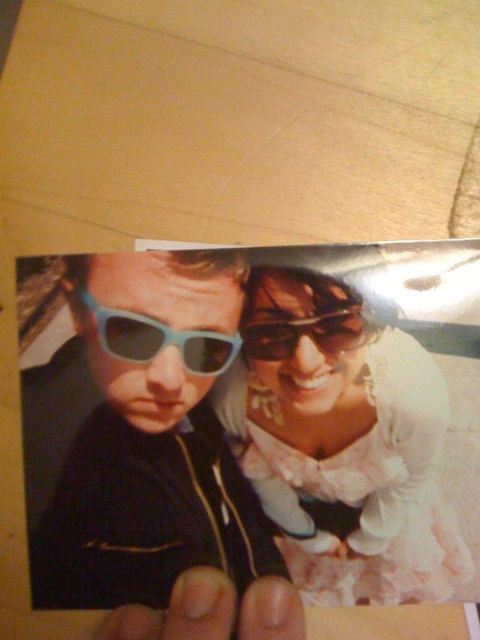
You are a photographer trying to frame a shot. You have the matte plastic sunglasses at left and the matte white dress at center in your viewfinder. Based on their positions and the scene described, which object would you adjust to ensure both fit within the frame?

The matte plastic sunglasses at left might be wider than the matte white dress at center, so you should adjust the matte plastic sunglasses at left to ensure both fit within the frame.

You are a photographer trying to frame two pairs of matte plastic sunglasses in a photo. The scene has the matte plastic sunglasses at left and the matte plastic sunglasses at upper center. Which pair is wider?

The matte plastic sunglasses at left is wider than the matte plastic sunglasses at upper center.